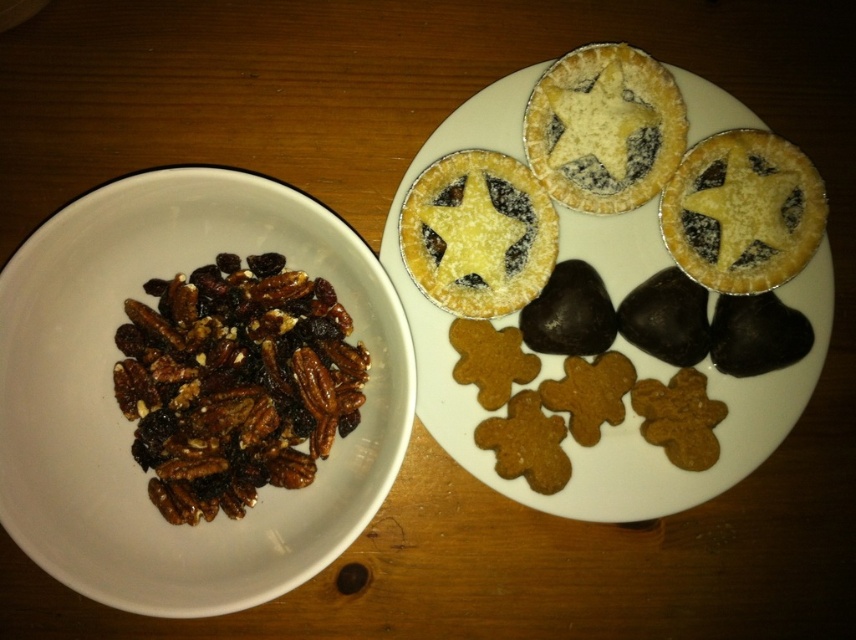
Question: Is matte golden pie at upper right to the left of golden crumbly pastry at center from the viewer's perspective?

Choices:
 (A) no
 (B) yes

Answer: (A)

Question: Among these points, which one is farthest from the camera?

Choices:
 (A) (631, 196)
 (B) (376, 262)

Answer: (A)

Question: Does brown crunchy nuts at left appear on the right side of golden crumbly pastry at upper center?

Choices:
 (A) no
 (B) yes

Answer: (A)

Question: Which object is farther from the camera taking this photo?

Choices:
 (A) golden crumbly pastry at upper center
 (B) brown matte nuts at left

Answer: (A)

Question: Is brown matte nuts at left to the right of golden crumbly pastry at upper center from the viewer's perspective?

Choices:
 (A) yes
 (B) no

Answer: (B)

Question: Which object is farther from the camera taking this photo?

Choices:
 (A) golden crumbly pastry at center
 (B) golden crumbly pastry at upper center

Answer: (A)